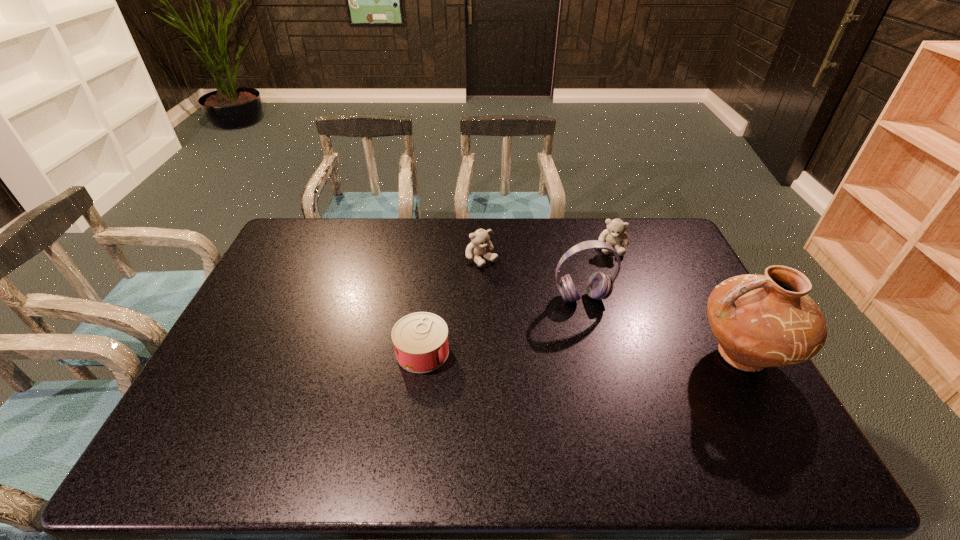
Find the location of `vacant region between the second tallest object and the fourth object from right to left`. vacant region between the second tallest object and the fourth object from right to left is located at coordinates (532, 279).

The height and width of the screenshot is (540, 960). I want to click on vacant space in between the second object from left to right and the second object from right to left, so click(x=547, y=253).

Locate an element on the screen. vacant space that's between the shortest object and the headset is located at coordinates (502, 325).

You are a GUI agent. You are given a task and a screenshot of the screen. Output one action in this format:
    pyautogui.click(x=<x>, y=<y>)
    Task: Click on the free space between the fourth shortest object and the tallest object
    This screenshot has height=540, width=960.
    Given the screenshot: What is the action you would take?
    pyautogui.click(x=662, y=327)

Where is `vacant area between the tallest object and the left teddy bear`? vacant area between the tallest object and the left teddy bear is located at coordinates pyautogui.click(x=612, y=307).

Locate an element on the screen. Image resolution: width=960 pixels, height=540 pixels. free space between the fourth object from right to left and the shortest object is located at coordinates (452, 306).

Identify the location of empty space that is in between the tallest object and the leftmost object. The height and width of the screenshot is (540, 960). (582, 354).

Identify which object is the second nearest to the second object from left to right. Please provide its 2D coordinates. Your answer should be formatted as a tuple, i.e. [(x, y)], where the tuple contains the x and y coordinates of a point satisfying the conditions above.

[(420, 340)]

This screenshot has width=960, height=540. I want to click on object that is the second nearest to the pottery, so click(615, 235).

I want to click on vacant region that satisfies the following two spatial constraints: 1. on the front side of the tallest object; 2. on the side of the left teddy bear with the handle, so click(x=482, y=355).